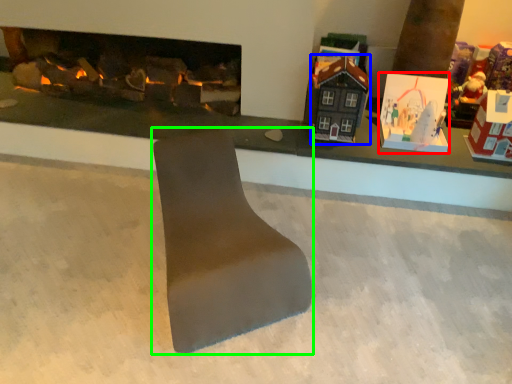
Question: Which is nearer to the toy (highlighted by a red box)? toy (highlighted by a blue box) or footrest (highlighted by a green box).

Choices:
 (A) toy
 (B) footrest

Answer: (A)